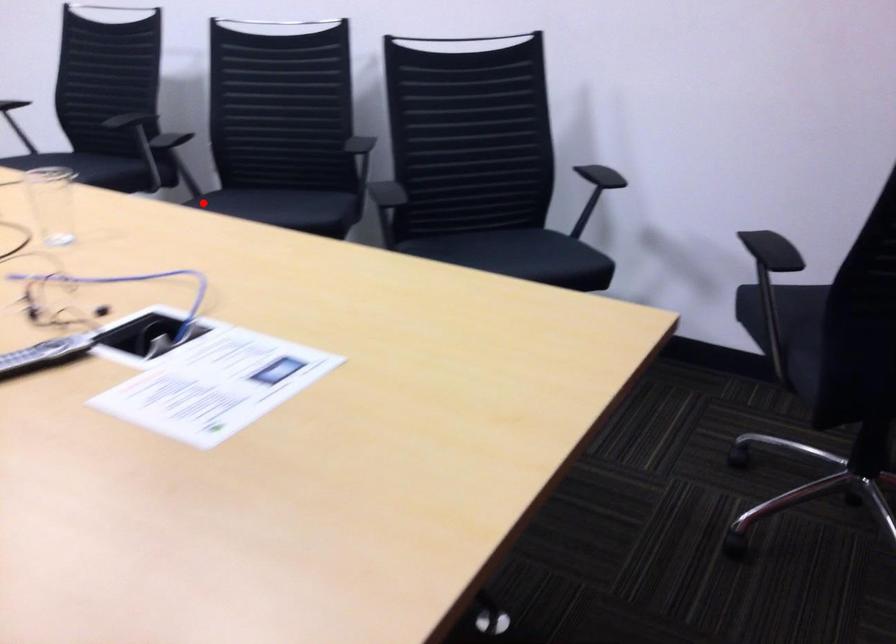
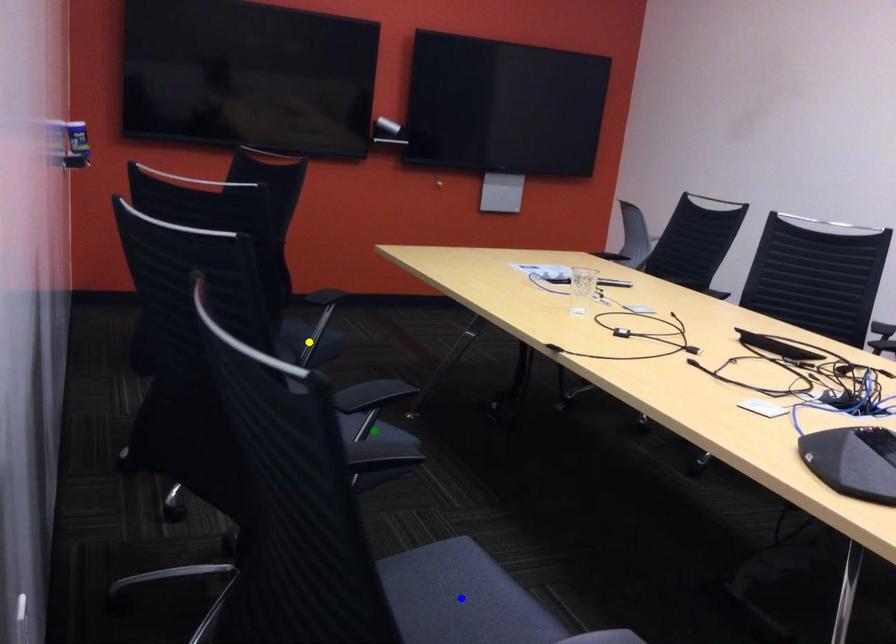
Question: I am providing you with two images of the same scene from different viewpoints. A red point is marked on the first image. You are given multiple points on the second image. Which point in image 2 is actually the same real-world point as the red point in image 1?

Choices:
 (A) blue point
 (B) green point
 (C) yellow point

Answer: (B)